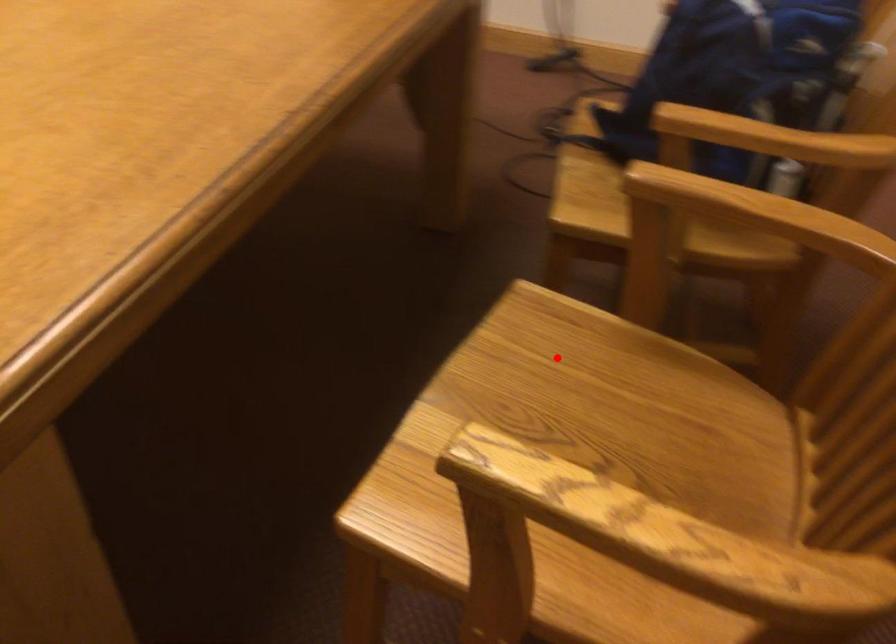
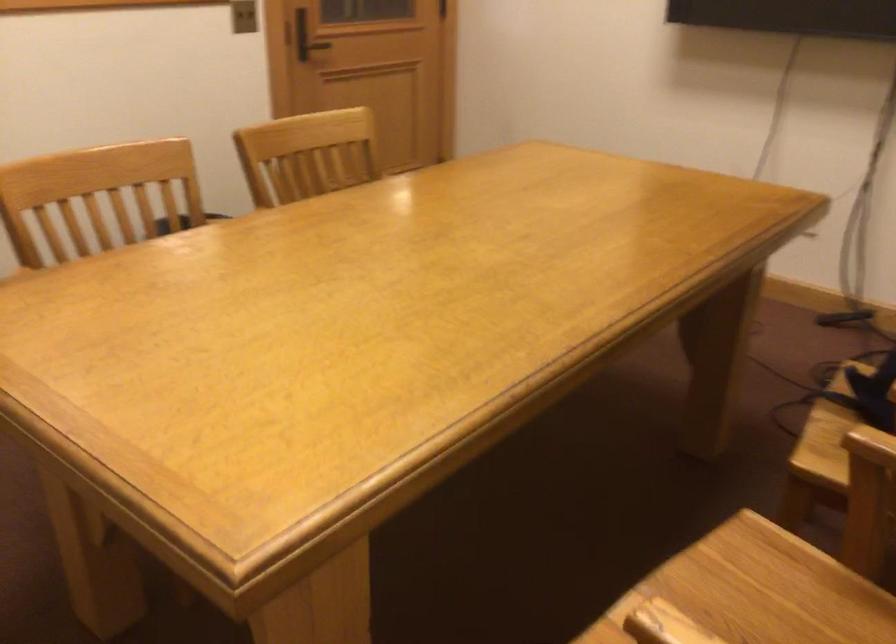
Find the pixel in the second image that matches the highlighted location in the first image.

(764, 588)